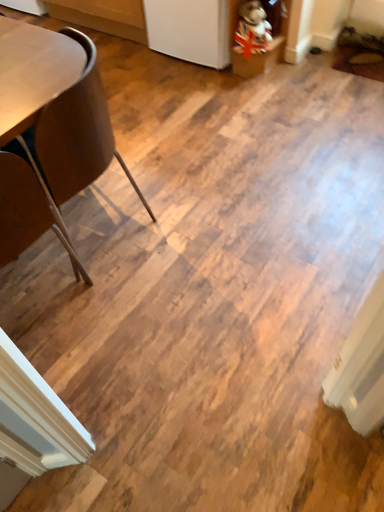
Question: Considering the relative sizes of brown leather chair at left, which is counted as the 1th chair, starting from the top, and brown leather chair at left, which is counted as the first chair, starting from the bottom, in the image provided, is brown leather chair at left, which is counted as the 1th chair, starting from the top, wider than brown leather chair at left, which is counted as the first chair, starting from the bottom,?

Choices:
 (A) no
 (B) yes

Answer: (B)

Question: Is brown leather chair at left, positioned as the 2th chair in bottom-to-top order, facing towards brown leather chair at left, which is counted as the first chair, starting from the bottom?

Choices:
 (A) yes
 (B) no

Answer: (A)

Question: Considering the relative positions of brown leather chair at left, positioned as the 2th chair in bottom-to-top order, and brown leather chair at left, which is counted as the first chair, starting from the bottom, in the image provided, is brown leather chair at left, positioned as the 2th chair in bottom-to-top order, in front of brown leather chair at left, which is counted as the first chair, starting from the bottom,?

Choices:
 (A) no
 (B) yes

Answer: (A)

Question: From a real-world perspective, is brown leather chair at left, which is counted as the 1th chair, starting from the top, positioned over brown leather chair at left, which is counted as the first chair, starting from the bottom, based on gravity?

Choices:
 (A) yes
 (B) no

Answer: (B)

Question: From a real-world perspective, is brown leather chair at left, which is counted as the 1th chair, starting from the top, positioned under brown leather chair at left, acting as the 2th chair starting from the top, based on gravity?

Choices:
 (A) no
 (B) yes

Answer: (B)

Question: Does brown leather chair at left, which is counted as the 1th chair, starting from the top, contain brown leather chair at left, acting as the 2th chair starting from the top?

Choices:
 (A) yes
 (B) no

Answer: (B)

Question: From a real-world perspective, is union jack plush at upper right over brown leather chair at left, which is counted as the 1th chair, starting from the top?

Choices:
 (A) yes
 (B) no

Answer: (B)

Question: From the image's perspective, does union jack plush at upper right appear higher than brown leather chair at left, which is counted as the 1th chair, starting from the top?

Choices:
 (A) yes
 (B) no

Answer: (A)

Question: Is union jack plush at upper right positioned with its back to brown leather chair at left, which is counted as the 1th chair, starting from the top?

Choices:
 (A) no
 (B) yes

Answer: (A)

Question: Is union jack plush at upper right to the left of brown leather chair at left, positioned as the 2th chair in bottom-to-top order, from the viewer's perspective?

Choices:
 (A) no
 (B) yes

Answer: (A)

Question: From a real-world perspective, is union jack plush at upper right located beneath brown leather chair at left, positioned as the 2th chair in bottom-to-top order?

Choices:
 (A) no
 (B) yes

Answer: (B)

Question: Can you confirm if union jack plush at upper right is smaller than brown leather chair at left, positioned as the 2th chair in bottom-to-top order?

Choices:
 (A) no
 (B) yes

Answer: (B)

Question: Is brown leather chair at left, positioned as the 2th chair in bottom-to-top order, surrounded by brown leather chair at left, acting as the 2th chair starting from the top?

Choices:
 (A) yes
 (B) no

Answer: (B)